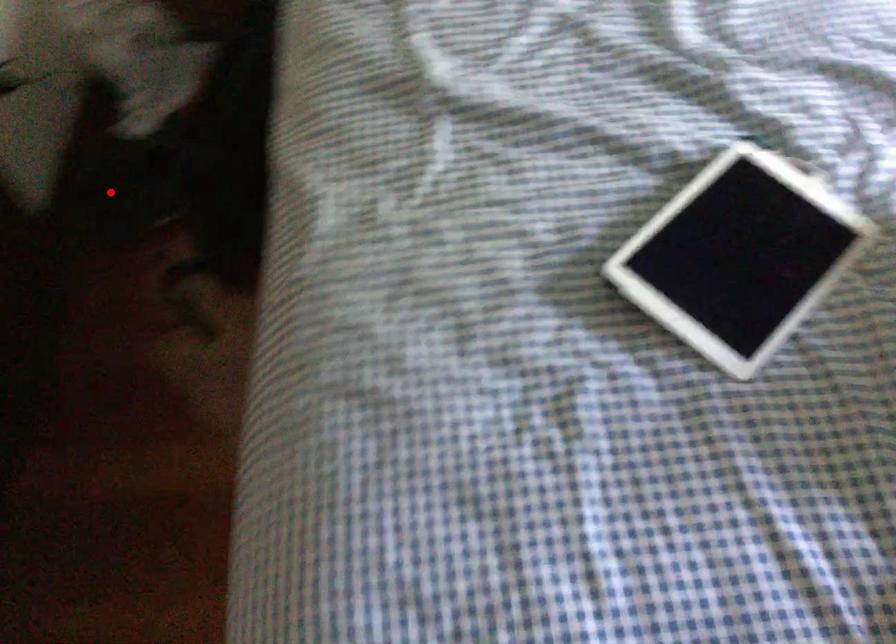
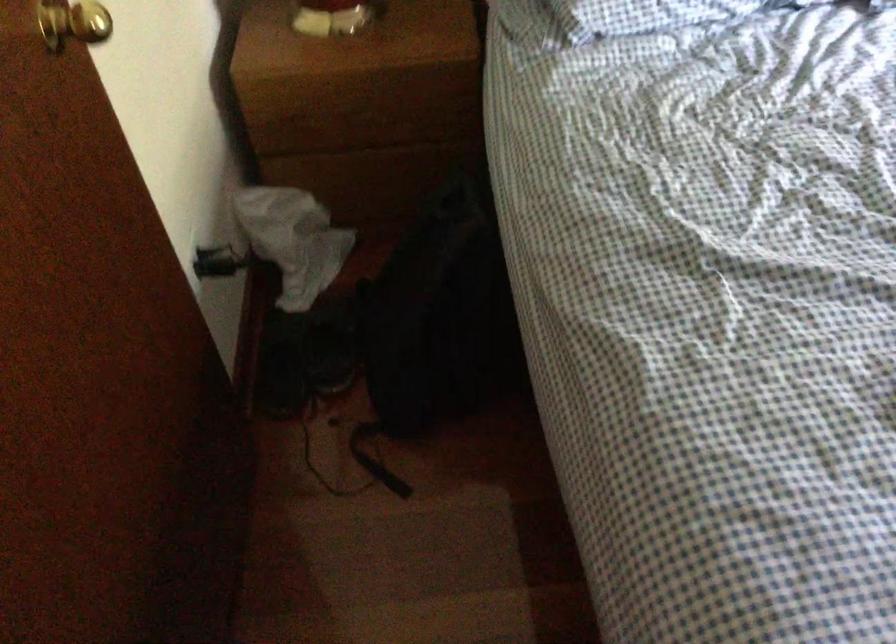
Find the pixel in the second image that matches the highlighted location in the first image.

(282, 363)